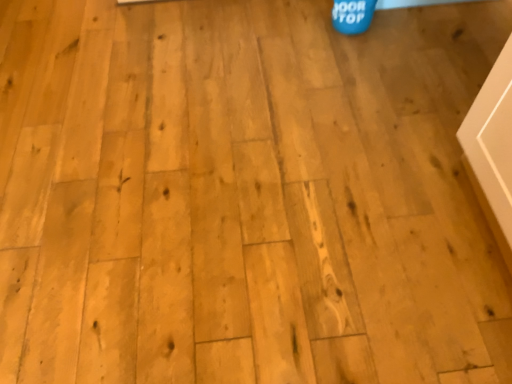
Find the location of a particular element. The image size is (512, 384). free space to the left of blue rubber door stop at upper right is located at coordinates (305, 25).